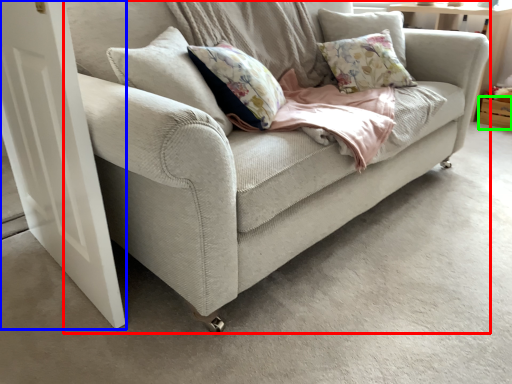
Question: Based on their relative distances, which object is nearer to studio couch (highlighted by a red box)? Choose from screen door (highlighted by a blue box) and drawer (highlighted by a green box).

Choices:
 (A) screen door
 (B) drawer

Answer: (A)